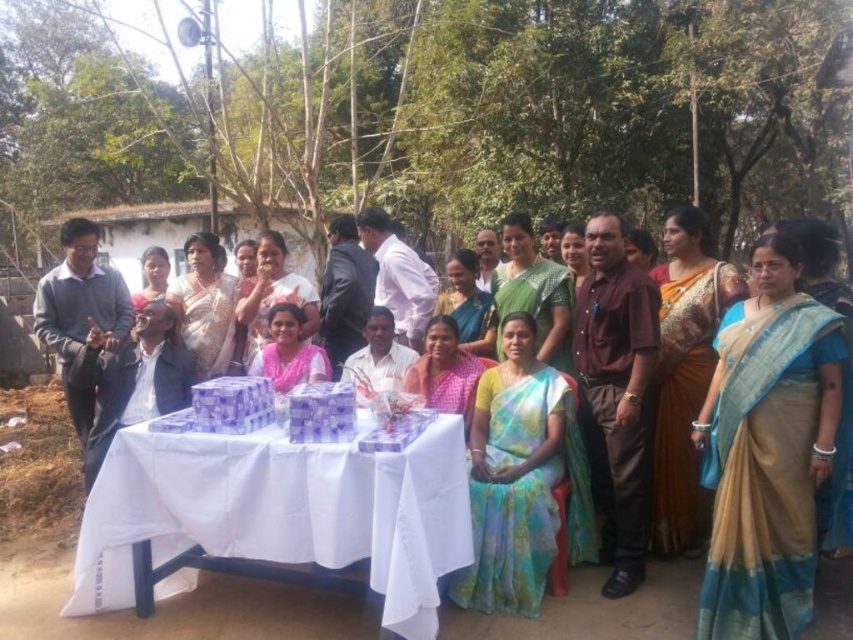
Question: From the image, what is the correct spatial relationship of matte pink saree at center in relation to matte green saree at center?

Choices:
 (A) right
 (B) left

Answer: (B)

Question: Does light blue saree at center have a lesser width compared to matte pink saree at center?

Choices:
 (A) no
 (B) yes

Answer: (A)

Question: Which point is farther from the camera taking this photo?

Choices:
 (A) (401, 570)
 (B) (187, 340)
 (C) (647, 246)
 (D) (148, 298)

Answer: (D)

Question: Which point is farther from the camera taking this photo?

Choices:
 (A) (212, 310)
 (B) (273, 348)
 (C) (651, 262)

Answer: (A)

Question: Does white paper table at center have a lesser width compared to beige silk saree at right?

Choices:
 (A) yes
 (B) no

Answer: (B)

Question: Which point is farther to the camera?

Choices:
 (A) (730, 321)
 (B) (289, 483)
 (C) (223, 330)

Answer: (C)